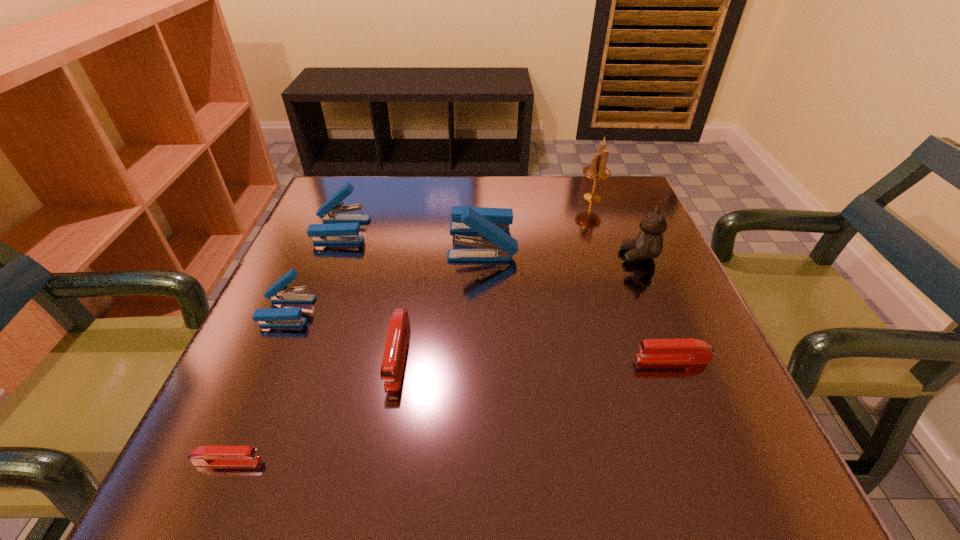
Locate which object ranks fifth in proximity to the rightmost stapler. Please provide its 2D coordinates. Your answer should be formatted as a tuple, i.e. [(x, y)], where the tuple contains the x and y coordinates of a point satisfying the conditions above.

[(279, 292)]

Where is `stapler that is the fourth closest one to the fourth stapler from left to right`? The image size is (960, 540). stapler that is the fourth closest one to the fourth stapler from left to right is located at coordinates (344, 228).

The width and height of the screenshot is (960, 540). I want to click on stapler that is the second closest one to the fifth shortest stapler, so click(492, 224).

Find the location of a particular element. This screenshot has height=540, width=960. blue stapler that stands as the closest to the second tallest stapler is located at coordinates (279, 292).

You are a GUI agent. You are given a task and a screenshot of the screen. Output one action in this format:
    pyautogui.click(x=<x>, y=<y>)
    Task: Click on the blue stapler that is the closest to the fourth shortest object
    The image size is (960, 540).
    Given the screenshot: What is the action you would take?
    pyautogui.click(x=344, y=228)

Where is `the third closest red stapler to the second stapler from right to left`? The width and height of the screenshot is (960, 540). the third closest red stapler to the second stapler from right to left is located at coordinates point(212,456).

The image size is (960, 540). I want to click on red stapler that is the closest to the farthest object, so [689, 350].

This screenshot has height=540, width=960. Identify the location of free space that satisfies the following two spatial constraints: 1. on the face of the brown teddy bear; 2. on the front-facing side of the third shortest object. (680, 354).

The width and height of the screenshot is (960, 540). I want to click on vacant space that satisfies the following two spatial constraints: 1. on the front side of the second tallest stapler; 2. on the right side of the fifth object from left to right, so click(x=336, y=242).

What are the coordinates of `vacant space that satisfies the following two spatial constraints: 1. on the face of the brown teddy bear; 2. on the front-facing side of the sixth tallest object` in the screenshot? It's located at (680, 354).